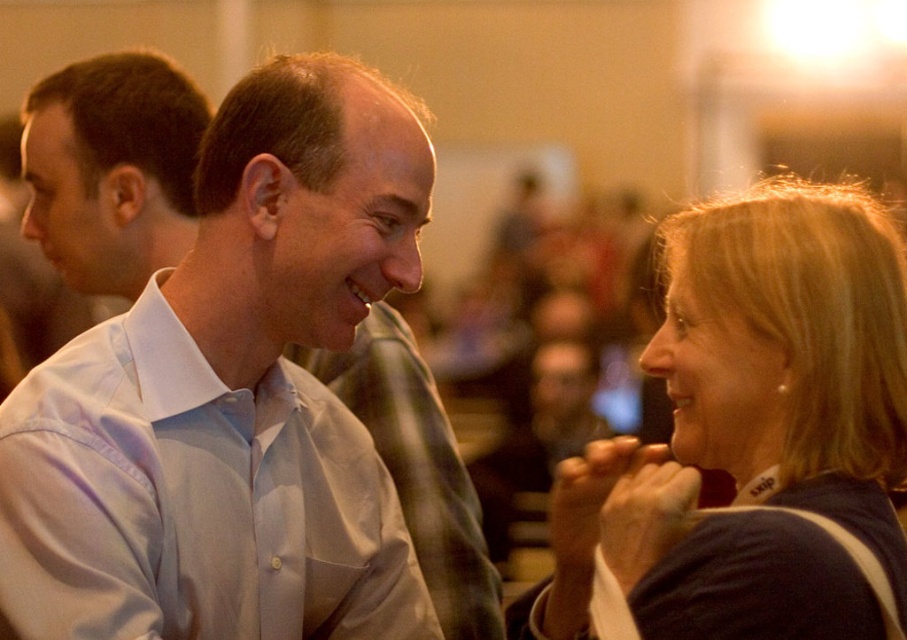
You are a GUI agent. You are given a task and a screenshot of the screen. Output one action in this format:
    pyautogui.click(x=<x>, y=<y>)
    Task: Click on the blonde hair at upper right
    The height and width of the screenshot is (640, 907).
    Given the screenshot: What is the action you would take?
    pyautogui.click(x=764, y=422)

Is point (717, 204) positioned in front of point (400, 518)?

Yes, point (717, 204) is closer to viewer.

At what (x,y) coordinates should I click in order to perform the action: click on blonde hair at upper right. Please return your answer as a coordinate pair (x, y). Looking at the image, I should click on click(x=764, y=422).